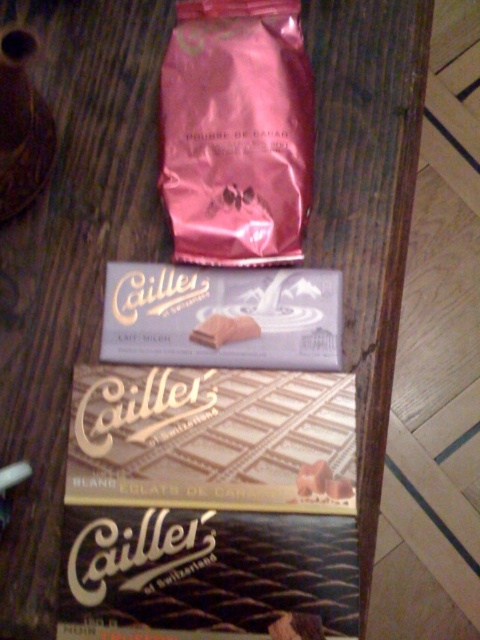
Does point (142, 483) come in front of point (197, 304)?

Yes, point (142, 483) is closer to viewer.

Which is above, gold foil chocolate bar at center or white cardboard chocolate bar at center?

white cardboard chocolate bar at center is above.

Image resolution: width=480 pixels, height=640 pixels. I want to click on gold foil chocolate bar at center, so click(213, 438).

Between point (299, 134) and point (231, 324), which one is positioned behind?

Point (231, 324)

Can you confirm if pink metallic bag at upper center is positioned below white matte chocolate bar at center?

No.

Where is `pink metallic bag at upper center`? This screenshot has width=480, height=640. pink metallic bag at upper center is located at coordinates (237, 131).

I want to click on pink metallic bag at upper center, so click(237, 131).

Which is more to the left, gold foil chocolate bar at center or pink metallic bag at upper center?

gold foil chocolate bar at center

Who is more distant from viewer, (201, 372) or (205, 125)?

The point (205, 125) is more distant.

The image size is (480, 640). What do you see at coordinates (213, 438) in the screenshot?
I see `gold foil chocolate bar at center` at bounding box center [213, 438].

The height and width of the screenshot is (640, 480). In order to click on gold foil chocolate bar at center in this screenshot , I will do `click(213, 438)`.